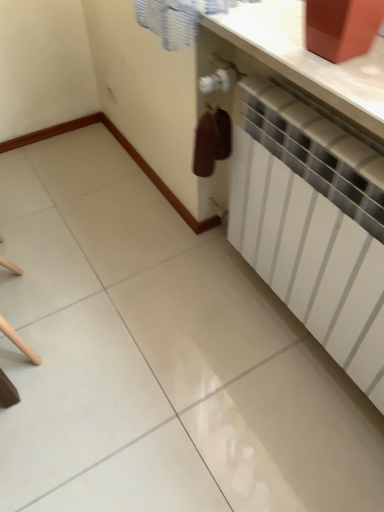
The width and height of the screenshot is (384, 512). Describe the element at coordinates (312, 223) in the screenshot. I see `white matte radiator at center` at that location.

The width and height of the screenshot is (384, 512). I want to click on white matte radiator at center, so click(x=312, y=223).

What do you see at coordinates (308, 59) in the screenshot? The image size is (384, 512). I see `white glossy counter top at upper right` at bounding box center [308, 59].

This screenshot has width=384, height=512. In order to click on white glossy counter top at upper right in this screenshot , I will do `click(308, 59)`.

In order to click on white matte radiator at center in this screenshot , I will do `click(312, 223)`.

Does white glossy counter top at upper right appear on the right side of white matte radiator at center?

No, white glossy counter top at upper right is not to the right of white matte radiator at center.

Does white glossy counter top at upper right lie in front of white matte radiator at center?

No, it is not.

Considering the positions of points (256, 40) and (323, 238), is point (256, 40) farther from camera compared to point (323, 238)?

That is False.

From the image's perspective, is white glossy counter top at upper right under white matte radiator at center?

Incorrect, from the image's perspective, white glossy counter top at upper right is higher than white matte radiator at center.

From a real-world perspective, is white glossy counter top at upper right above or below white matte radiator at center?

white glossy counter top at upper right is situated higher than white matte radiator at center in the real world.

Does white glossy counter top at upper right have a lesser width compared to white matte radiator at center?

No.

Is white glossy counter top at upper right shorter than white matte radiator at center?

Yes.

From the picture: Considering the sizes of white glossy counter top at upper right and white matte radiator at center in the image, is white glossy counter top at upper right bigger or smaller than white matte radiator at center?

In the image, white glossy counter top at upper right appears to be smaller than white matte radiator at center.

Is white glossy counter top at upper right not within white matte radiator at center?

Yes, white glossy counter top at upper right is outside of white matte radiator at center.

Is white glossy counter top at upper right far from white matte radiator at center?

They are positioned close to each other.

Could you tell me if white glossy counter top at upper right is turned towards white matte radiator at center?

No, white glossy counter top at upper right is not facing towards white matte radiator at center.

Can you tell me how much white glossy counter top at upper right and white matte radiator at center differ in facing direction?

There is a 0.546-degree angle between the facing directions of white glossy counter top at upper right and white matte radiator at center.

Where is `radiator in front of the white glossy counter top at upper right`? radiator in front of the white glossy counter top at upper right is located at coordinates (312, 223).

Is white matte radiator at center to the right of white glossy counter top at upper right from the viewer's perspective?

Yes.

Who is more distant, white matte radiator at center or white glossy counter top at upper right?

white glossy counter top at upper right is behind.

Is point (379, 335) positioned in front of point (302, 47)?

No.

From the image's perspective, is white matte radiator at center below white glossy counter top at upper right?

Yes, from the image's perspective, white matte radiator at center is beneath white glossy counter top at upper right.

From a real-world perspective, who is located higher, white matte radiator at center or white glossy counter top at upper right?

In real-world perspective, white glossy counter top at upper right is above.

Looking at their sizes, would you say white matte radiator at center is wider or thinner than white glossy counter top at upper right?

Considering their sizes, white matte radiator at center looks slimmer than white glossy counter top at upper right.

Who is shorter, white matte radiator at center or white glossy counter top at upper right?

With less height is white glossy counter top at upper right.

Is white matte radiator at center bigger or smaller than white glossy counter top at upper right?

Clearly, white matte radiator at center is larger in size than white glossy counter top at upper right.

Is white matte radiator at center not within white glossy counter top at upper right?

Yes, white matte radiator at center is outside of white glossy counter top at upper right.

Is white matte radiator at center touching white glossy counter top at upper right?

No, white matte radiator at center is not beside white glossy counter top at upper right.

Is white matte radiator at center turned away from white glossy counter top at upper right?

white matte radiator at center does not have its back to white glossy counter top at upper right.

How different are the orientations of white matte radiator at center and white glossy counter top at upper right in degrees?

The angular difference between white matte radiator at center and white glossy counter top at upper right is 0.546 degrees.

The image size is (384, 512). In order to click on radiator below the white glossy counter top at upper right (from the image's perspective) in this screenshot , I will do `click(312, 223)`.

The height and width of the screenshot is (512, 384). I want to click on counter top behind the white matte radiator at center, so click(x=308, y=59).

Identify the location of counter top located on the left of white matte radiator at center. Image resolution: width=384 pixels, height=512 pixels. (308, 59).